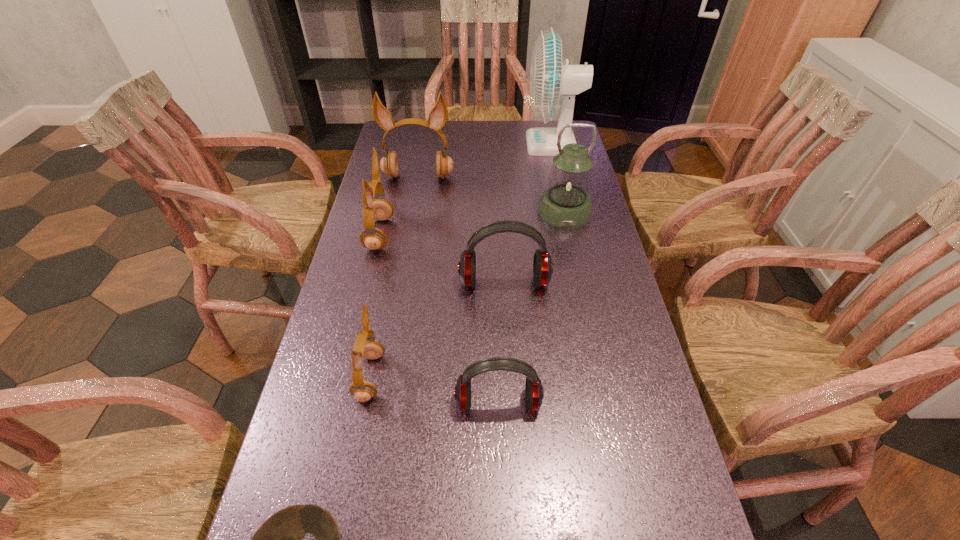
Where is `vacant position located 0.100m on the ear cups of the nearer red earphone`? The image size is (960, 540). vacant position located 0.100m on the ear cups of the nearer red earphone is located at coordinates (500, 468).

Where is `object that is at the far edge`? This screenshot has height=540, width=960. object that is at the far edge is located at coordinates [551, 80].

Image resolution: width=960 pixels, height=540 pixels. I want to click on fan that is at the right edge, so click(x=551, y=80).

I want to click on lantern located in the right edge section of the desktop, so click(566, 204).

At what (x,y) coordinates should I click in order to perform the action: click on object at the far right corner. Please return your answer as a coordinate pair (x, y). This screenshot has width=960, height=540. Looking at the image, I should click on (551, 80).

The height and width of the screenshot is (540, 960). In the image, there is a desktop. What are the coordinates of `vacant region at the far edge` in the screenshot? It's located at (489, 134).

The width and height of the screenshot is (960, 540). In the image, there is a desktop. In order to click on free space at the left edge in this screenshot , I will do `click(412, 200)`.

Where is `vacant region at the right edge of the desktop`? This screenshot has height=540, width=960. vacant region at the right edge of the desktop is located at coordinates (640, 474).

The height and width of the screenshot is (540, 960). Identify the location of vacant point at the far left corner. (402, 140).

The height and width of the screenshot is (540, 960). Identify the location of empty location between the farthest earphone and the smallest brown earphone. (395, 277).